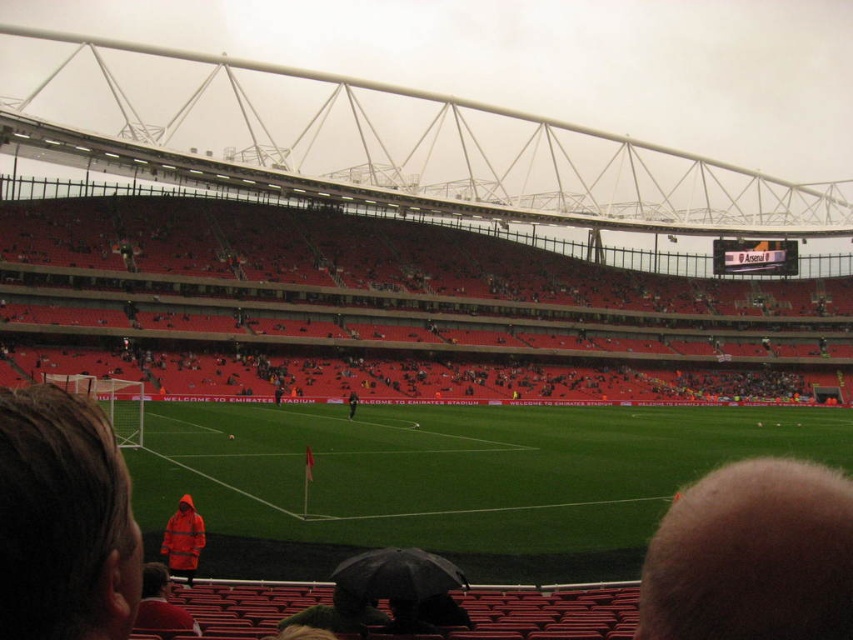
Question: From the image, what is the correct spatial relationship of orange raincoat at lower left in relation to orange waterproof jacket at lower left?

Choices:
 (A) left
 (B) right

Answer: (B)

Question: Which point appears farthest from the camera in this image?

Choices:
 (A) (355, 595)
 (B) (90, 513)
 (C) (827, 604)

Answer: (A)

Question: Does orange waterproof jacket at center have a larger size compared to red matte jacket at lower left?

Choices:
 (A) yes
 (B) no

Answer: (A)

Question: Does green matte umbrella at lower center have a lesser width compared to orange raincoat at center?

Choices:
 (A) no
 (B) yes

Answer: (A)

Question: Which of the following is the closest to the observer?

Choices:
 (A) (352, 416)
 (B) (173, 563)

Answer: (B)

Question: Which object is closer to the camera taking this photo?

Choices:
 (A) orange raincoat at lower left
 (B) orange raincoat at center
 (C) orange waterproof jacket at center

Answer: (A)